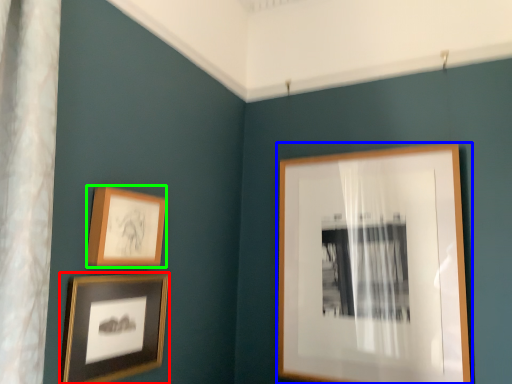
Question: Which is farther away from picture frame (highlighted by a red box)? picture frame (highlighted by a blue box) or picture frame (highlighted by a green box)?

Choices:
 (A) picture frame
 (B) picture frame

Answer: (A)